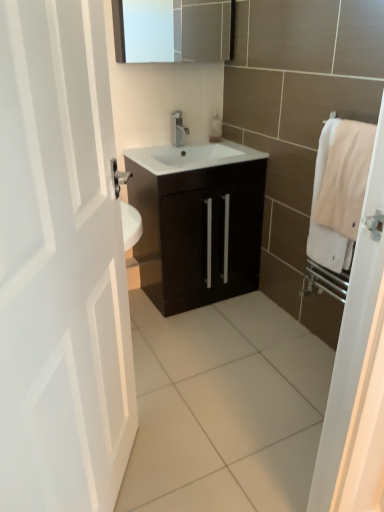
Where is `vacant space in front of translucent plastic soap dispenser at center`? This screenshot has width=384, height=512. vacant space in front of translucent plastic soap dispenser at center is located at coordinates (213, 147).